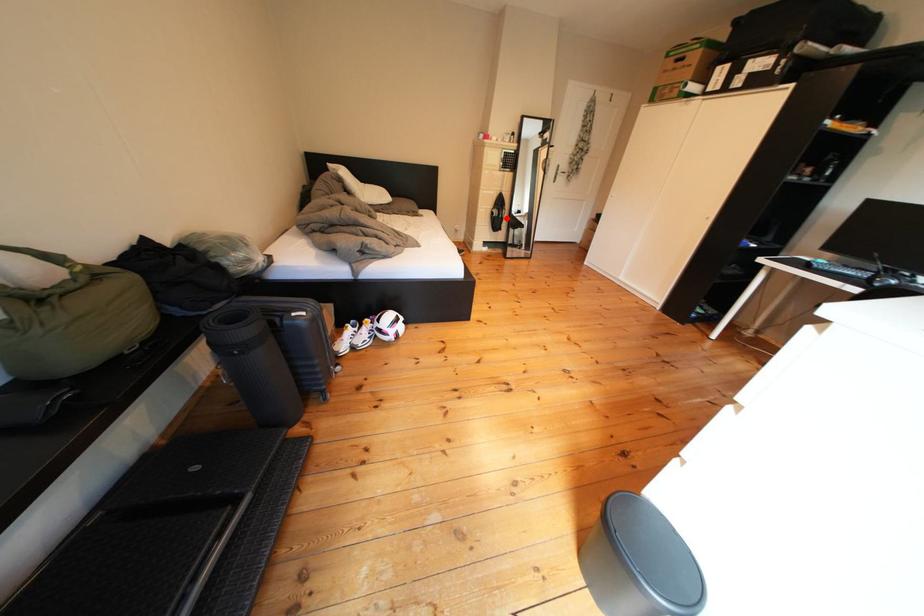
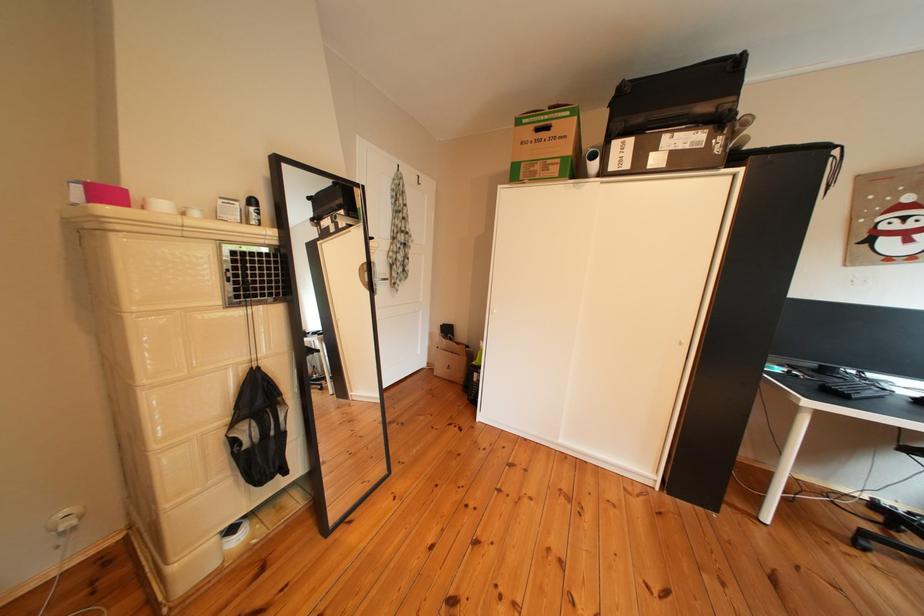
Question: I am providing you with two images of the same scene from different viewpoints. In image1, a red point is highlighted. Considering the same 3D point in image2, which of the following is correct?

Choices:
 (A) It is closer
 (B) It is farther

Answer: (B)